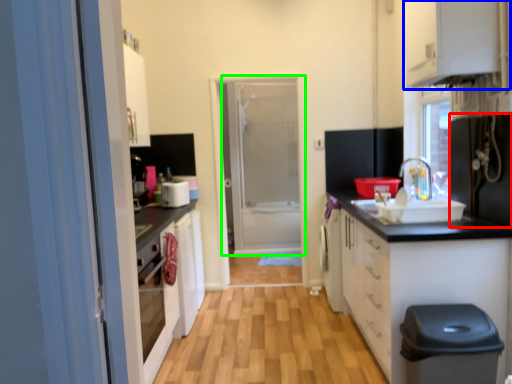
Question: Which object is positioned closest to appliance (highlighted by a red box)? Select from cabinetry (highlighted by a blue box) and door (highlighted by a green box).

Choices:
 (A) cabinetry
 (B) door

Answer: (A)